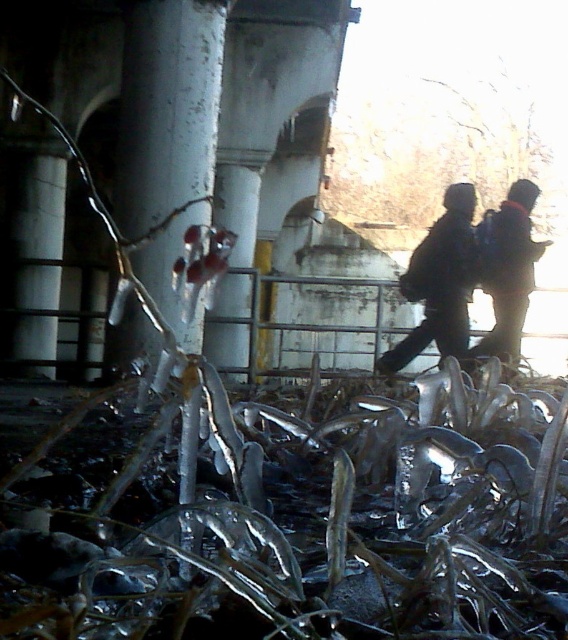
You are standing in front of the building with the metal railing. You want to reach the white glossy pillar at center. Which direction should you move relative to your current position?

The white glossy pillar at center is located at point coordinates, so you should move towards the center area of the scene to reach it.

You are standing in a cold winter landscape and see the white glossy pillar at center and the dark blue jacket at right. Which object would block your view more if you were to walk straight ahead?

The white glossy pillar at center would block your view more because it is bigger than the dark blue jacket at right.